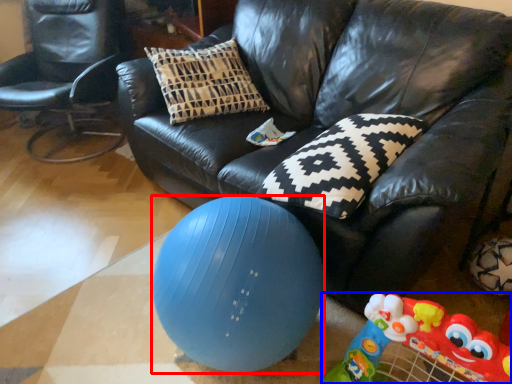
Question: Which point is further to the camera, ball (highlighted by a red box) or toy (highlighted by a blue box)?

Choices:
 (A) ball
 (B) toy

Answer: (A)